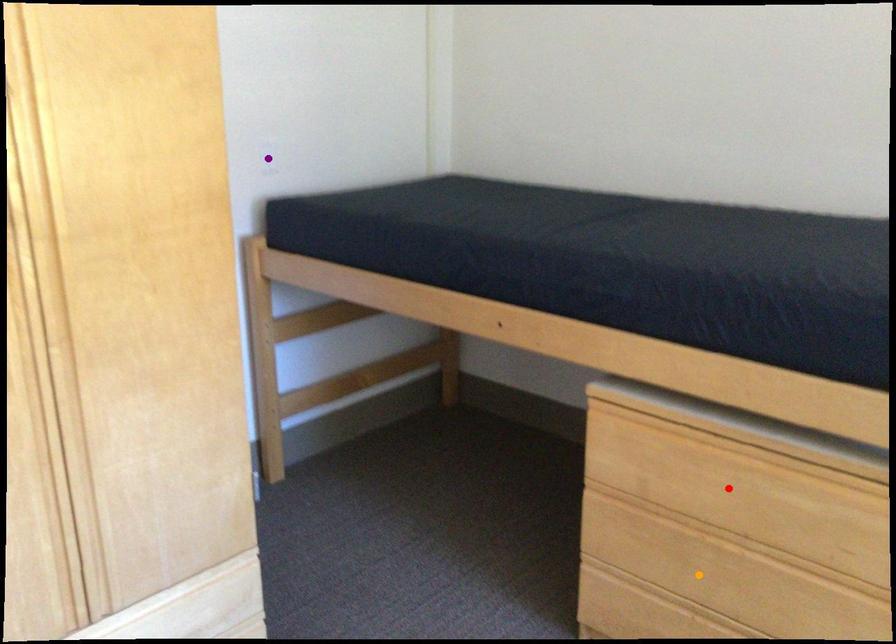
Order these from nearest to farthest:
A) purple point
B) red point
C) orange point

red point, orange point, purple point